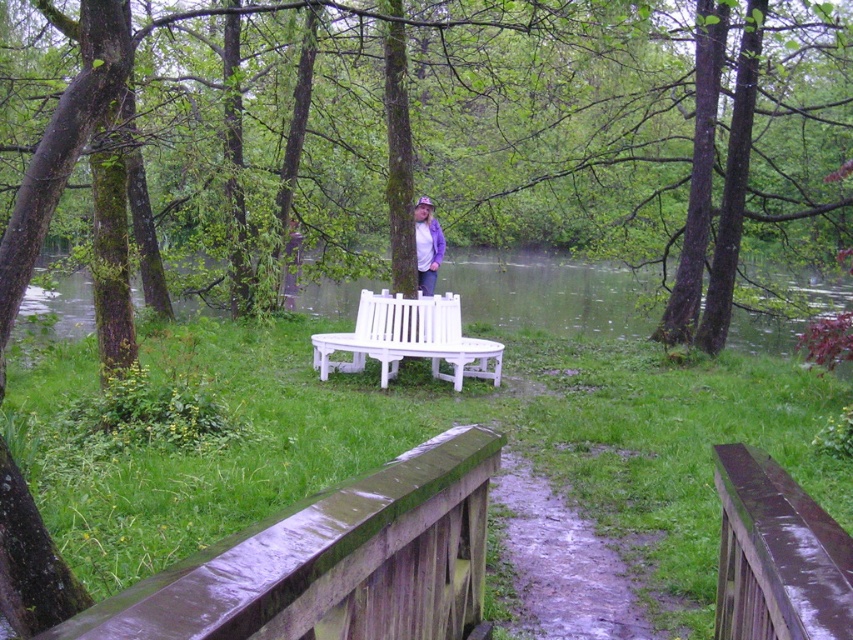
Does wooden rail at lower left have a greater height compared to purple fabric jacket at center?

No, wooden rail at lower left is not taller than purple fabric jacket at center.

Measure the distance between wooden rail at lower left and camera.

They are 4.51 feet apart.

This screenshot has width=853, height=640. I want to click on wooden rail at lower left, so click(x=331, y=561).

Describe the element at coordinates (331, 561) in the screenshot. I see `wooden rail at lower left` at that location.

Which is in front, point (447, 536) or point (781, 480)?

Point (781, 480)

Identify the location of wooden rail at lower left. (331, 561).

Can you confirm if white wood bench at center is positioned above purple fabric jacket at center?

No.

Who is taller, white wood bench at center or purple fabric jacket at center?

purple fabric jacket at center

In order to click on white wood bench at center in this screenshot , I will do `click(408, 339)`.

Locate an element on the screen. This screenshot has height=640, width=853. white wood bench at center is located at coordinates (408, 339).